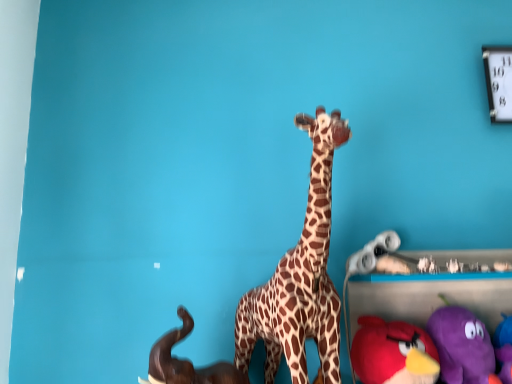
Question: Is brown matte elephant at lower left, marked as the 4th toy in a right-to-left arrangement, inside or outside of brown spotted fabric giraffe at center?

Choices:
 (A) outside
 (B) inside

Answer: (A)

Question: From a real-world perspective, is brown matte elephant at lower left, marked as the 4th toy in a right-to-left arrangement, positioned above or below brown spotted fabric giraffe at center?

Choices:
 (A) above
 (B) below

Answer: (B)

Question: Which of these objects is positioned farthest from the brown spotted fabric giraffe at center?

Choices:
 (A) velvet plush bird at lower right, positioned as the 3th toy in left-to-right order
 (B) white matte toy at center, marked as the 2th toy in a left-to-right arrangement
 (C) purple plush toy at lower right, positioned as the 4th toy in left-to-right order
 (D) metallic silver clock at upper right
 (E) brown matte elephant at lower left, which appears as the 1th toy when viewed from the left

Answer: (D)

Question: Estimate the real-world distances between objects in this image. Which object is closer to the purple plush toy at lower right, the first toy positioned from the right?

Choices:
 (A) white matte toy at center, which is the third toy in right-to-left order
 (B) metallic silver clock at upper right
 (C) velvet plush bird at lower right, which appears as the second toy when viewed from the right
 (D) brown matte elephant at lower left, which appears as the 1th toy when viewed from the left
 (E) brown spotted fabric giraffe at center

Answer: (C)